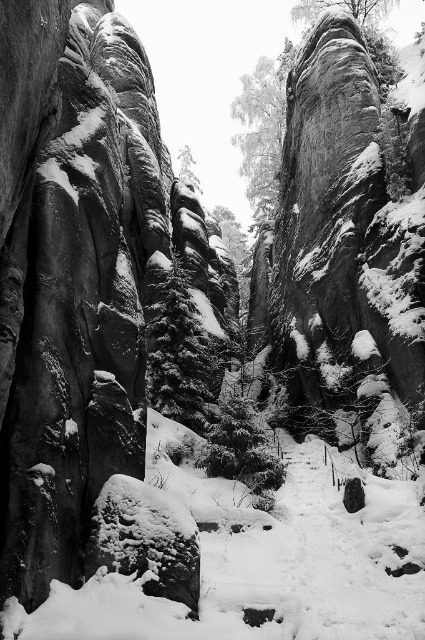
Is the position of green textured evergreen tree at center less distant than that of green textured pine at center?

Yes, it is in front of green textured pine at center.

Is point (189, 342) positioned behind point (178, 176)?

No, (189, 342) is in front of (178, 176).

This screenshot has width=425, height=640. Describe the element at coordinates (176, 348) in the screenshot. I see `green textured evergreen tree at center` at that location.

The height and width of the screenshot is (640, 425). What are the coordinates of `green textured evergreen tree at center` in the screenshot? It's located at 176,348.

Is smooth gray rock at upper center positioned before green textured evergreen tree at center?

No, it is not.

Who is positioned more to the left, smooth gray rock at upper center or green textured evergreen tree at center?

green textured evergreen tree at center is more to the left.

At what (x,y) coordinates should I click in order to perform the action: click on smooth gray rock at upper center. Please return your answer as a coordinate pair (x, y). This screenshot has width=425, height=640. Looking at the image, I should click on (263, 129).

This screenshot has height=640, width=425. I want to click on smooth gray rock at upper center, so click(x=263, y=129).

Looking at this image, is smooth gray rock at upper center to the left of green textured pine at center from the viewer's perspective?

No, smooth gray rock at upper center is not to the left of green textured pine at center.

Who is more forward, (246,170) or (184,179)?

Point (184,179) is in front.

The image size is (425, 640). Describe the element at coordinates (263, 129) in the screenshot. I see `smooth gray rock at upper center` at that location.

Image resolution: width=425 pixels, height=640 pixels. Identify the location of smooth gray rock at upper center. (263, 129).